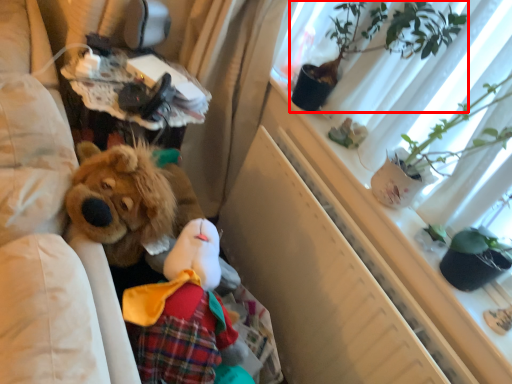
Question: From the image's perspective, considering the relative positions of houseplant (annotated by the red box) and window screen in the image provided, where is houseplant (annotated by the red box) located with respect to the staircase?

Choices:
 (A) below
 (B) above

Answer: (B)